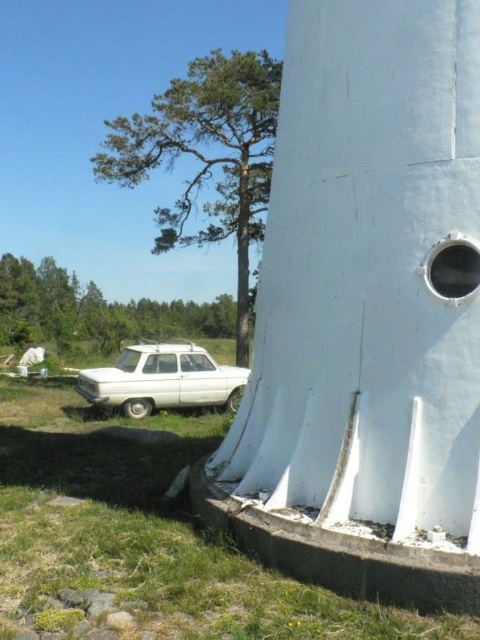
You are a delivery person trying to park your truck in the area near the white matte sedan at lower left and the metallic circular hole at right. Based on the space they occupy, which object should you avoid to ensure enough room for your truck?

You should avoid the metallic circular hole at right because the white matte sedan at lower left occupies less space, meaning the area near the metallic circular hole at right has more space available for parking.

You are standing at the center of the image and want to walk towards the green grass at lower left and the white matte sedan at lower left. Which direction should you walk to reach both?

Since both the green grass at lower left and the white matte sedan at lower left are located at the lower left, you should walk towards the lower left direction to reach both.

You are a photographer trying to capture both the white matte sedan at lower left and the metallic circular hole at right in a single frame. Based on their positions, can you determine which object is closer to the camera?

The white matte sedan at lower left is located below the metallic circular hole at right, so it is closer to the camera than the metallic circular hole at right.